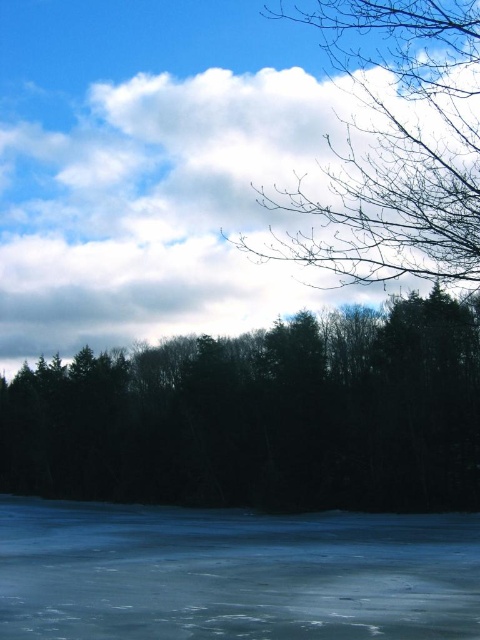
Can you confirm if dark green textured trees at center is wider than bare branches at upper right?

Yes.

Is point (61, 460) positioned in front of point (400, 22)?

No, (61, 460) is further to viewer.

This screenshot has height=640, width=480. I want to click on dark green textured trees at center, so click(x=262, y=417).

Can you confirm if transparent ice at bottom is taller than bare branches at upper right?

Incorrect, transparent ice at bottom's height is not larger of bare branches at upper right's.

Can you confirm if transparent ice at bottom is thinner than bare branches at upper right?

In fact, transparent ice at bottom might be wider than bare branches at upper right.

Does point (479, 579) come in front of point (348, 10)?

Yes, point (479, 579) is closer to viewer.

Where is `transparent ice at bottom`? transparent ice at bottom is located at coordinates (233, 573).

Is dark green textured trees at center below transparent ice at bottom?

Incorrect, dark green textured trees at center is not positioned below transparent ice at bottom.

Who is more distant from viewer, [96,372] or [61,506]?

The point [96,372] is more distant.

Find the location of a particular element. This screenshot has width=480, height=640. dark green textured trees at center is located at coordinates (262, 417).